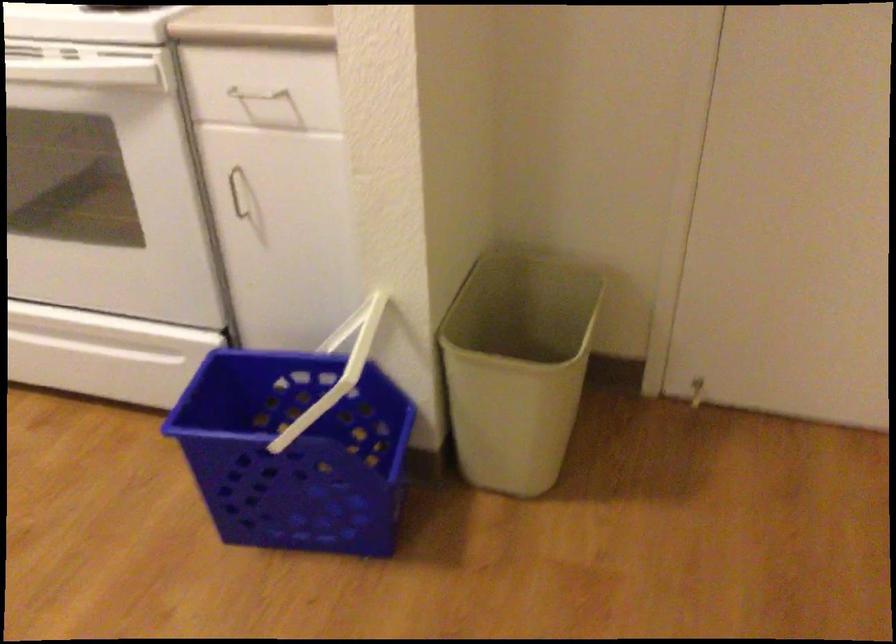
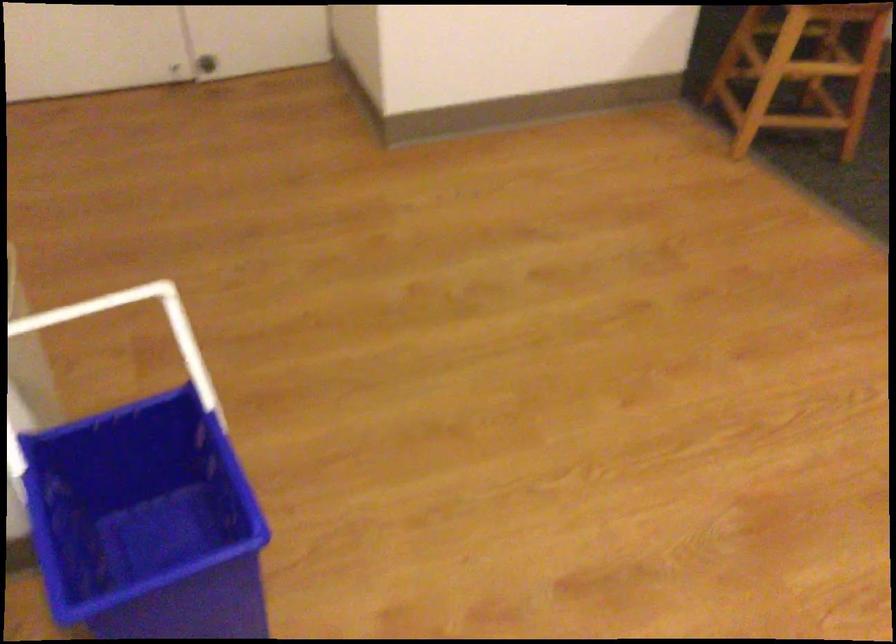
Where in the second image is the point corresponding to point (366, 339) from the first image?

(58, 316)